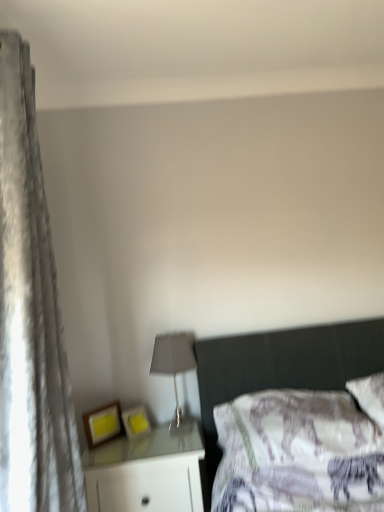
Where is `vacant area that lies between matte yellow picture frame at lower center, the 1th picture frame when ordered from right to left, and matte gray lampshade at center`? This screenshot has width=384, height=512. vacant area that lies between matte yellow picture frame at lower center, the 1th picture frame when ordered from right to left, and matte gray lampshade at center is located at coordinates (149, 435).